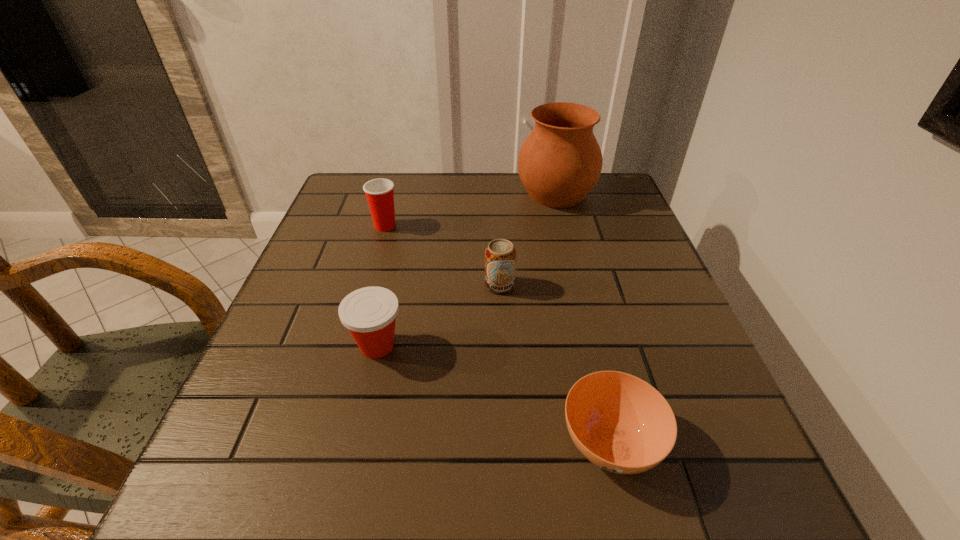
Where is `free space between the farthest object and the soup bowl`? The height and width of the screenshot is (540, 960). free space between the farthest object and the soup bowl is located at coordinates (583, 318).

Where is `empty space that is in between the beer can and the soup bowl`? empty space that is in between the beer can and the soup bowl is located at coordinates (555, 363).

Where is `unoccupied area between the beer can and the second farthest object`? unoccupied area between the beer can and the second farthest object is located at coordinates (443, 255).

The width and height of the screenshot is (960, 540). I want to click on free spot between the nearest object and the second nearest object, so [493, 394].

Identify the location of vacant space in between the third farthest object and the tallest object. pos(528,240).

Identify the location of empty location between the third object from right to left and the soup bowl. (555, 363).

The width and height of the screenshot is (960, 540). In order to click on vacant space that's between the fourth farthest object and the tallest object in this screenshot , I will do `click(467, 270)`.

The height and width of the screenshot is (540, 960). What are the coordinates of `unoccupied position between the beer can and the nearer Dixie cup` in the screenshot? It's located at (439, 315).

Find the location of a particular element. The height and width of the screenshot is (540, 960). object that is the second closest one to the farthest object is located at coordinates (379, 192).

Choose which object is the fourth nearest neighbor to the second farthest object. Please provide its 2D coordinates. Your answer should be formatted as a tuple, i.e. [(x, y)], where the tuple contains the x and y coordinates of a point satisfying the conditions above.

[(622, 424)]